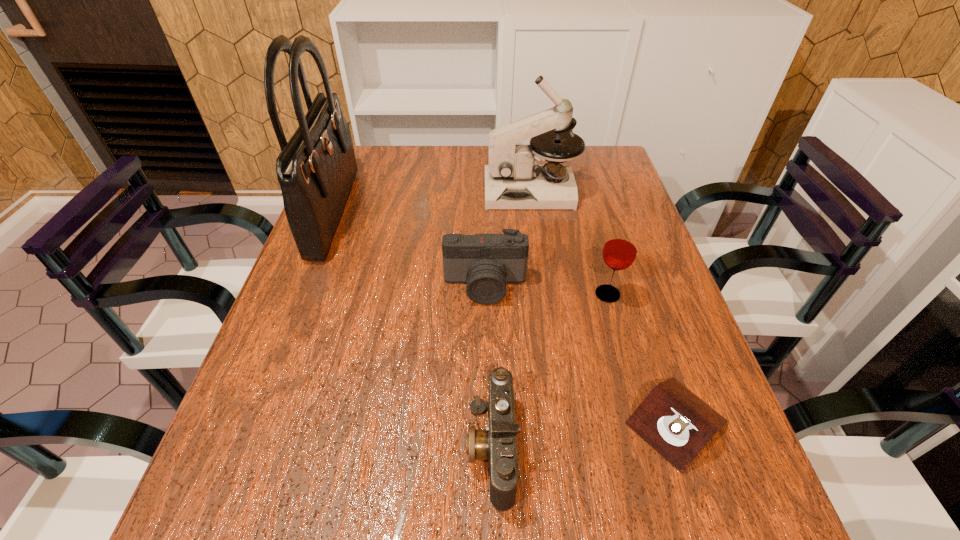
In the image, there is a desktop. Identify the location of vacant region at the left edge. (312, 362).

I want to click on vacant space at the far left corner, so click(385, 159).

You are a GUI agent. You are given a task and a screenshot of the screen. Output one action in this format:
    pyautogui.click(x=<x>, y=<y>)
    Task: Click on the blank space at the far right corner
    The image size is (960, 540).
    Given the screenshot: What is the action you would take?
    pyautogui.click(x=603, y=159)

What are the coordinates of `vacant area between the shortest object and the second shortest object` in the screenshot? It's located at (584, 435).

The width and height of the screenshot is (960, 540). I want to click on free point between the microscope and the shortest object, so click(x=604, y=307).

Locate an element on the screen. This screenshot has width=960, height=540. unoccupied area between the leftmost object and the microscope is located at coordinates (433, 201).

At what (x,y) coordinates should I click in order to perform the action: click on free spot between the nearer camera and the handbag. Please return your answer as a coordinate pair (x, y). Looking at the image, I should click on (414, 329).

This screenshot has height=540, width=960. What are the coordinates of `vacant space that's between the farther camera and the leftmost object` in the screenshot? It's located at (410, 248).

The height and width of the screenshot is (540, 960). I want to click on empty space that is in between the microscope and the shortest object, so click(x=604, y=307).

You are a GUI agent. You are given a task and a screenshot of the screen. Output one action in this format:
    pyautogui.click(x=<x>, y=<y>)
    Task: Click on the free space between the fourth shortest object and the taller camera
    This screenshot has height=540, width=960.
    Given the screenshot: What is the action you would take?
    pyautogui.click(x=546, y=290)